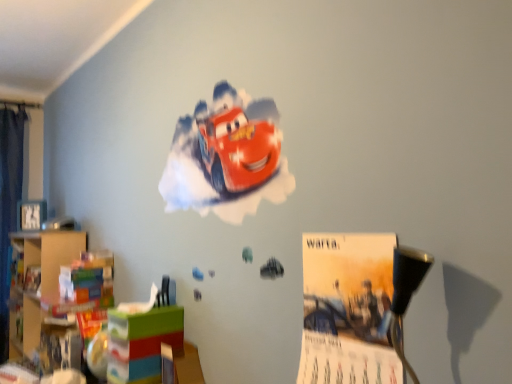
Question: Can you see matte plastic toy box at lower left touching wooden bookshelf at left?

Choices:
 (A) yes
 (B) no

Answer: (B)

Question: Considering the relative sizes of matte plastic toy box at lower left and wooden bookshelf at left in the image provided, is matte plastic toy box at lower left wider than wooden bookshelf at left?

Choices:
 (A) no
 (B) yes

Answer: (A)

Question: Could you tell me if matte plastic toy box at lower left is facing wooden bookshelf at left?

Choices:
 (A) yes
 (B) no

Answer: (B)

Question: Does matte plastic toy box at lower left have a lesser width compared to wooden bookshelf at left?

Choices:
 (A) yes
 (B) no

Answer: (A)

Question: Is matte plastic toy box at lower left further to the viewer compared to wooden bookshelf at left?

Choices:
 (A) no
 (B) yes

Answer: (A)

Question: Looking at the image, does matte plastic toy box at lower left seem bigger or smaller compared to wooden bookshelf at left?

Choices:
 (A) big
 (B) small

Answer: (B)

Question: From the image's perspective, relative to wooden bookshelf at left, is matte plastic toy box at lower left above or below?

Choices:
 (A) above
 (B) below

Answer: (A)

Question: In terms of width, does matte plastic toy box at lower left look wider or thinner when compared to wooden bookshelf at left?

Choices:
 (A) thin
 (B) wide

Answer: (A)

Question: Choose the correct answer: Is matte plastic toy box at lower left inside wooden bookshelf at left or outside it?

Choices:
 (A) outside
 (B) inside

Answer: (A)

Question: From a real-world perspective, is wooden bookshelf at left physically located above or below matte plastic toy box at lower left?

Choices:
 (A) below
 (B) above

Answer: (B)

Question: Looking at the image, does wooden bookshelf at left seem bigger or smaller compared to matte plastic toy box at lower left?

Choices:
 (A) big
 (B) small

Answer: (A)

Question: From the image's perspective, is wooden bookshelf at left located above or below matte plastic toy box at lower left?

Choices:
 (A) above
 (B) below

Answer: (B)

Question: Considering the positions of point (38, 236) and point (111, 329), is point (38, 236) closer or farther from the camera than point (111, 329)?

Choices:
 (A) closer
 (B) farther

Answer: (B)

Question: Is point (119, 329) positioned closer to the camera than point (297, 380)?

Choices:
 (A) farther
 (B) closer

Answer: (A)

Question: Looking at their shapes, would you say matte plastic toy box at lower left is wider or thinner than matte paper poster at center?

Choices:
 (A) wide
 (B) thin

Answer: (A)